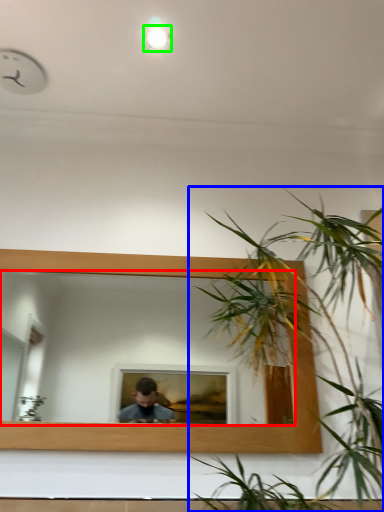
Question: Which object is positioned farthest from mirror (highlighted by a red box)? Select from houseplant (highlighted by a blue box) and light (highlighted by a green box).

Choices:
 (A) houseplant
 (B) light

Answer: (B)